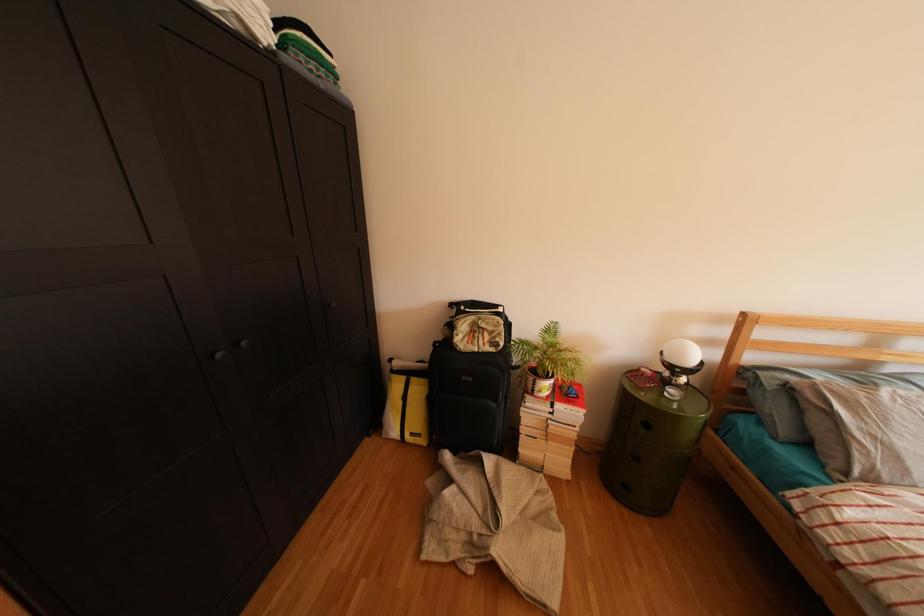
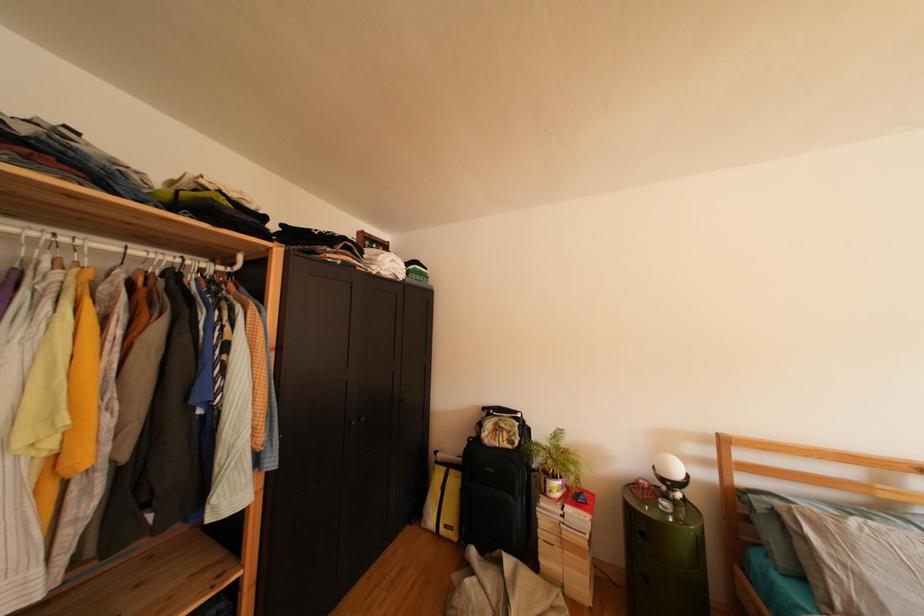
Question: How did the camera likely rotate?

Choices:
 (A) Left
 (B) Right
 (C) Up
 (D) Down

Answer: (C)